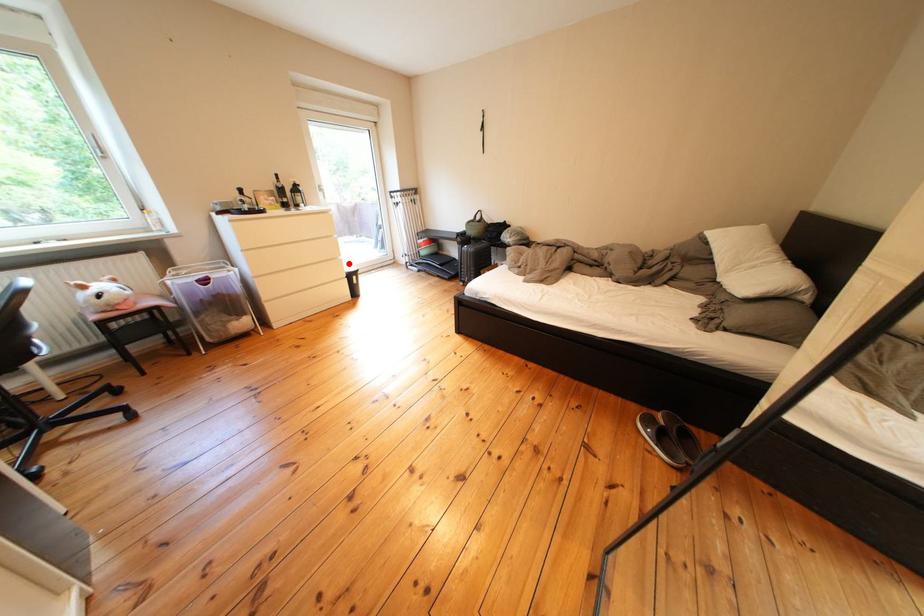
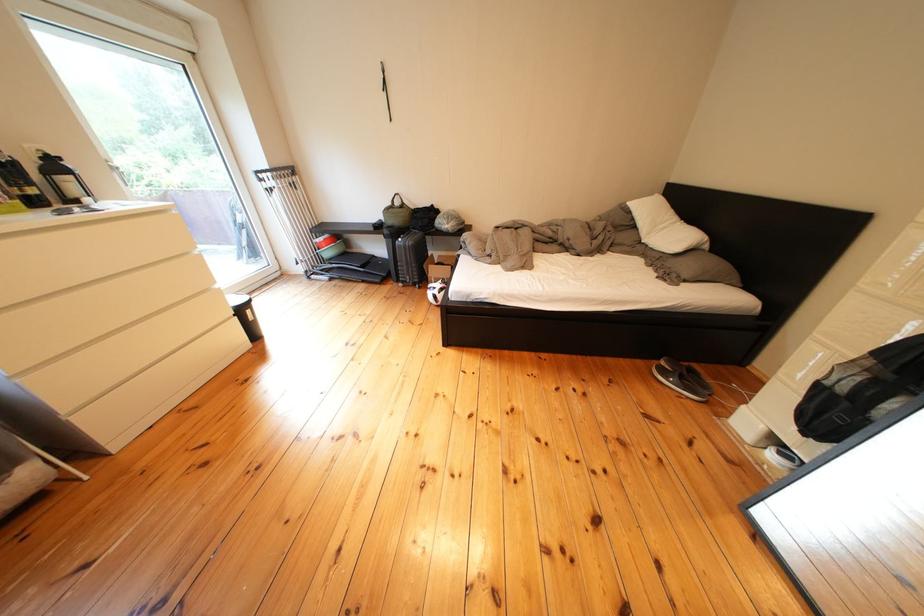
Question: A red point is marked in image1. In image2, is the corresponding 3D point closer to the camera or farther? Reply with the corresponding letter.

Choices:
 (A) The corresponding 3D point is closer.
 (B) The corresponding 3D point is farther.

Answer: (B)